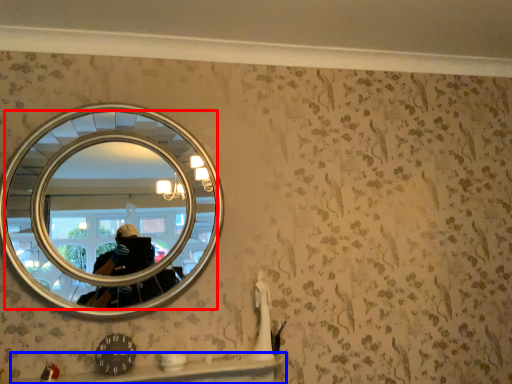
Question: Which point is closer to the camera, mirror (highlighted by a red box) or ledge (highlighted by a blue box)?

Choices:
 (A) mirror
 (B) ledge

Answer: (B)